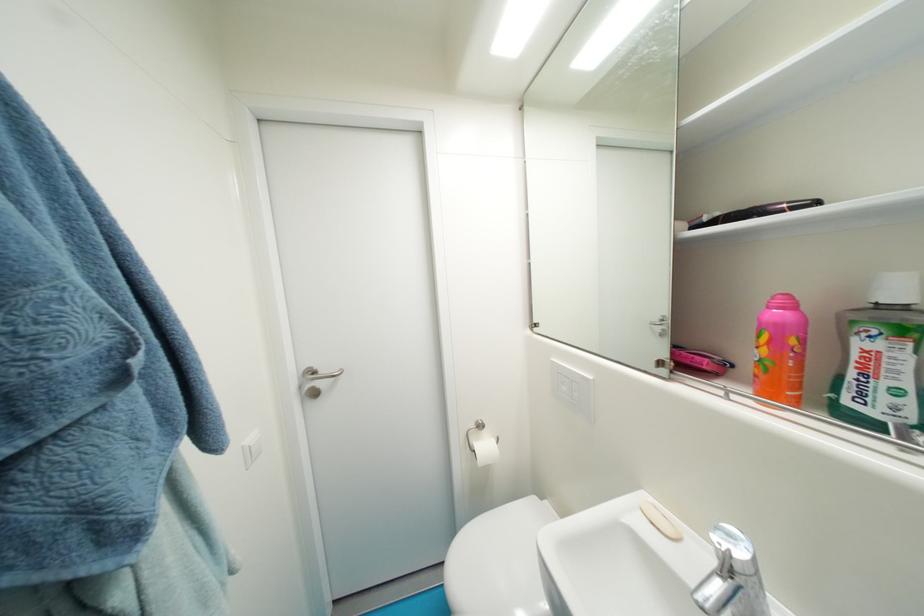
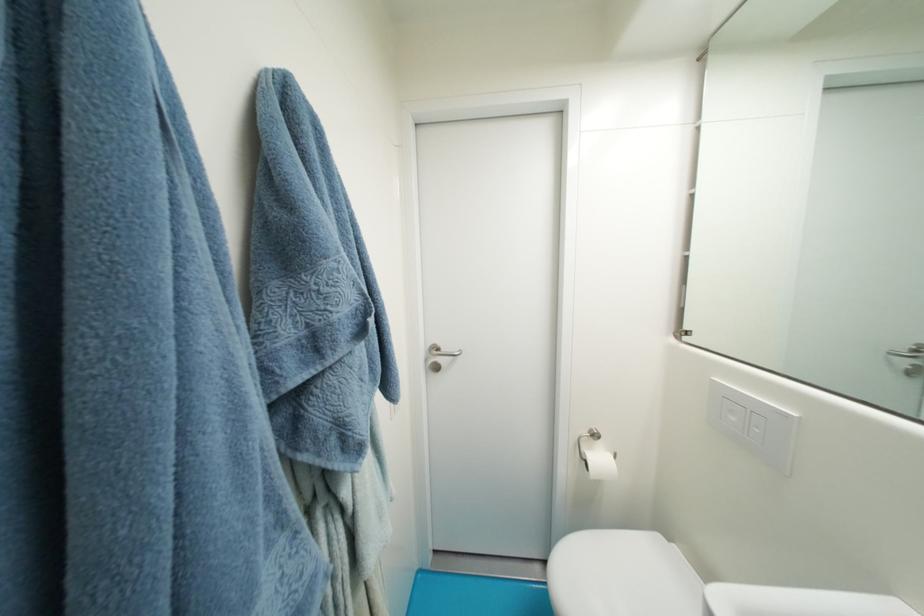
Question: The camera is either moving clockwise (left) or counter-clockwise (right) around the object. The first image is from the beginning of the video and the second image is from the end. Is the camera moving left or right when shooting the video?

Choices:
 (A) Left
 (B) Right

Answer: (B)